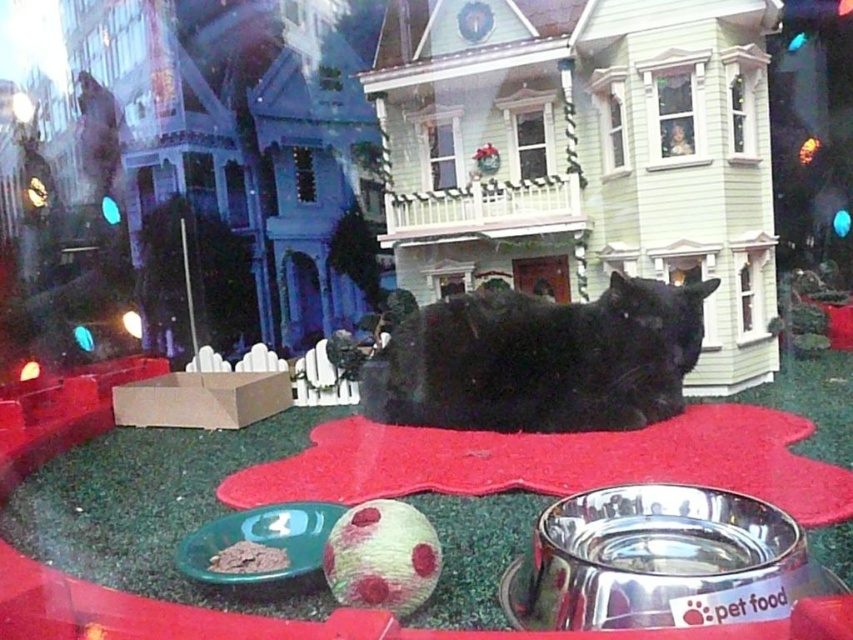
Can you confirm if black fur cat at center is positioned above clear glass window at upper center?

Incorrect, black fur cat at center is not positioned above clear glass window at upper center.

Is black fur cat at center wider than clear glass window at upper center?

Yes, black fur cat at center is wider than clear glass window at upper center.

Does point (442, 323) come in front of point (682, 97)?

Yes, it is.

This screenshot has width=853, height=640. In order to click on black fur cat at center in this screenshot , I will do `click(540, 360)`.

Is black fur cat at center to the right of polka-dotted fabric ball at center from the viewer's perspective?

Correct, you'll find black fur cat at center to the right of polka-dotted fabric ball at center.

Between black fur cat at center and polka-dotted fabric ball at center, which one has more height?

With more height is black fur cat at center.

Which is behind, point (601, 404) or point (375, 589)?

The point (601, 404) is more distant.

Locate an element on the screen. This screenshot has width=853, height=640. black fur cat at center is located at coordinates (540, 360).

Who is lower down, clear glass window at upper center or brown crumbly pet food at lower center?

brown crumbly pet food at lower center

This screenshot has width=853, height=640. I want to click on clear glass window at upper center, so click(x=674, y=106).